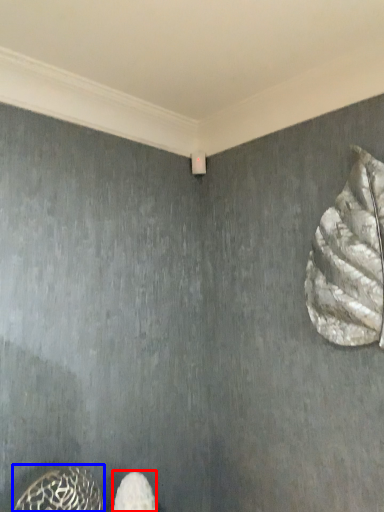
Question: Which object is closer to the camera taking this photo, footwear (highlighted by a red box) or animal (highlighted by a blue box)?

Choices:
 (A) footwear
 (B) animal

Answer: (B)